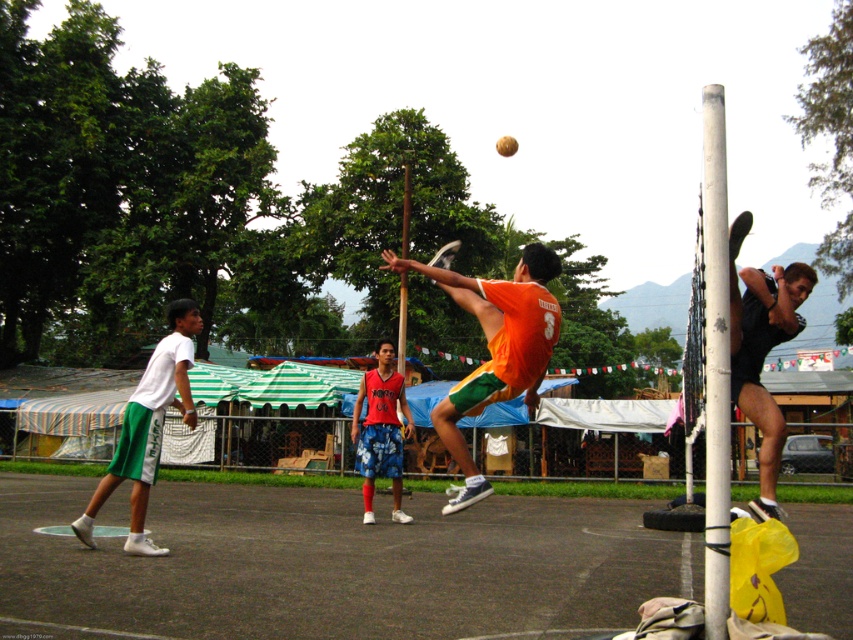
You are a photographer standing behind the volleyball net. You see the smooth asphalt court at center and the white matte shorts at left. Which object is closer to the ground?

The smooth asphalt court at center is located below white matte shorts at left, so the smooth asphalt court at center is closer to the ground.

You are a photographer standing at the edge of the volleyball court. You need to capture a photo of the red fabric shorts at center without the white painted wood pole at right appearing in the frame. Is this possible based on their heights?

The white painted wood pole at right is taller than the red fabric shorts at center, so it might block the view. However, since the pole is at the right and the shorts are at the center, you can adjust your angle to avoid the pole while focusing on the shorts at the center.